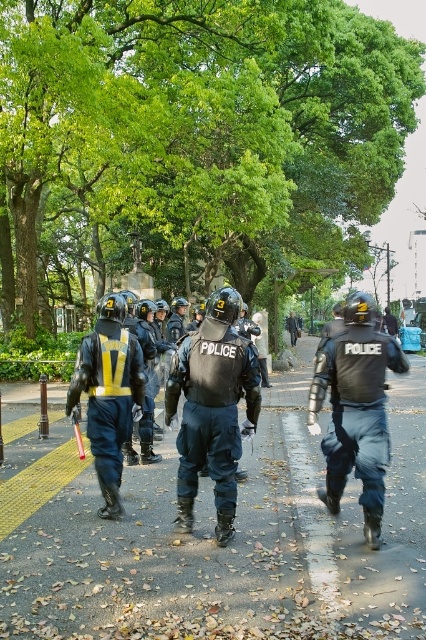
Is matte black vest at center taller than reflective blue vest at center?

Indeed, matte black vest at center has a greater height compared to reflective blue vest at center.

Describe the element at coordinates (213, 406) in the screenshot. I see `matte black vest at center` at that location.

Between point (224, 545) and point (141, 412), which one is positioned behind?

Point (141, 412)

Where is `matte black vest at center`? The width and height of the screenshot is (426, 640). matte black vest at center is located at coordinates (213, 406).

Between smooth asphalt road at center and matte black vest at center, which one is positioned higher?

matte black vest at center is higher up.

Which is in front, point (89, 534) or point (235, 435)?

Point (235, 435) is in front.

Image resolution: width=426 pixels, height=640 pixels. I want to click on smooth asphalt road at center, so click(227, 547).

Who is positioned more to the left, matte black police uniform at center or reflective blue vest at center?

reflective blue vest at center

What do you see at coordinates (356, 408) in the screenshot? This screenshot has height=640, width=426. I see `matte black police uniform at center` at bounding box center [356, 408].

This screenshot has height=640, width=426. I want to click on matte black police uniform at center, so click(356, 408).